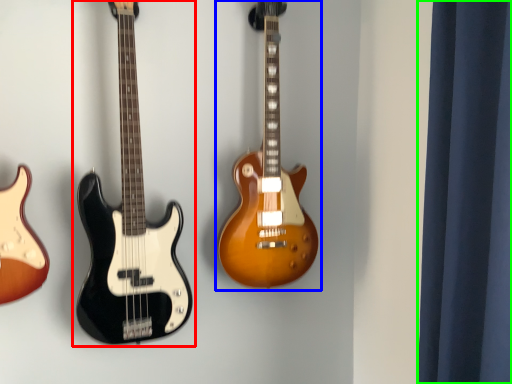
Question: Which is nearer to the guitar (highlighted by a red box)? guitar (highlighted by a blue box) or curtain (highlighted by a green box).

Choices:
 (A) guitar
 (B) curtain

Answer: (A)